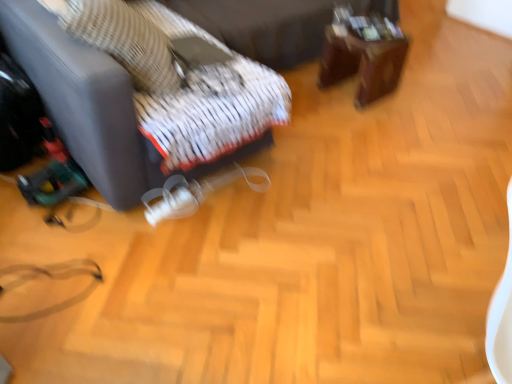
Question: Is the position of woven fabric pillow at upper left more distant than that of brown wooden table at upper right?

Choices:
 (A) no
 (B) yes

Answer: (A)

Question: Does woven fabric pillow at upper left appear on the right side of brown wooden table at upper right?

Choices:
 (A) no
 (B) yes

Answer: (A)

Question: From the image's perspective, would you say woven fabric pillow at upper left is positioned over brown wooden table at upper right?

Choices:
 (A) yes
 (B) no

Answer: (B)

Question: Is woven fabric pillow at upper left far from brown wooden table at upper right?

Choices:
 (A) no
 (B) yes

Answer: (B)

Question: Is woven fabric pillow at upper left aimed at brown wooden table at upper right?

Choices:
 (A) yes
 (B) no

Answer: (A)

Question: From a real-world perspective, is woven fabric pillow at upper left above or below white textured fabric bed frame at upper center?

Choices:
 (A) above
 (B) below

Answer: (A)

Question: Relative to white textured fabric bed frame at upper center, is woven fabric pillow at upper left in front or behind?

Choices:
 (A) front
 (B) behind

Answer: (A)

Question: Is woven fabric pillow at upper left bigger or smaller than white textured fabric bed frame at upper center?

Choices:
 (A) small
 (B) big

Answer: (A)

Question: Looking at their shapes, would you say woven fabric pillow at upper left is wider or thinner than white textured fabric bed frame at upper center?

Choices:
 (A) wide
 (B) thin

Answer: (B)

Question: In the image, is matte black suitcase at lower left on the left side or the right side of woven fabric pillow at upper left?

Choices:
 (A) right
 (B) left

Answer: (B)

Question: In terms of size, does matte black suitcase at lower left appear bigger or smaller than woven fabric pillow at upper left?

Choices:
 (A) big
 (B) small

Answer: (A)

Question: Considering the positions of point (15, 14) and point (156, 41), is point (15, 14) closer or farther from the camera than point (156, 41)?

Choices:
 (A) farther
 (B) closer

Answer: (B)

Question: From their relative heights in the image, would you say matte black suitcase at lower left is taller or shorter than woven fabric pillow at upper left?

Choices:
 (A) tall
 (B) short

Answer: (A)

Question: Is brown wooden table at upper right to the left or to the right of woven fabric pillow at upper left in the image?

Choices:
 (A) left
 (B) right

Answer: (B)

Question: Based on their sizes in the image, would you say brown wooden table at upper right is bigger or smaller than woven fabric pillow at upper left?

Choices:
 (A) big
 (B) small

Answer: (B)